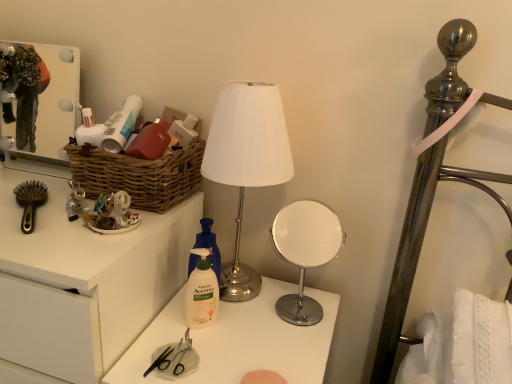
Where is `vacant area that is in front of white glossy mirror at center right`? vacant area that is in front of white glossy mirror at center right is located at coordinates (289, 347).